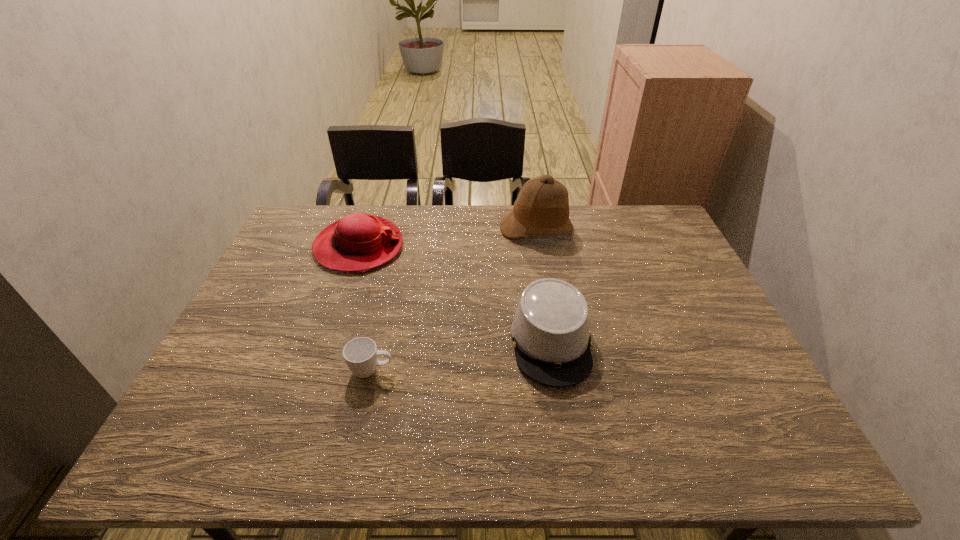
Locate an element on the screen. unoccupied position between the shortest object and the nearest hat is located at coordinates (462, 356).

Find the location of `vacant space that is in between the tallest object and the leftmost hat`. vacant space that is in between the tallest object and the leftmost hat is located at coordinates (447, 238).

This screenshot has height=540, width=960. In order to click on free space that is in between the shortest object and the tallest hat in this screenshot , I will do `click(454, 300)`.

You are a GUI agent. You are given a task and a screenshot of the screen. Output one action in this format:
    pyautogui.click(x=<x>, y=<y>)
    Task: Click on the free space that is in between the cup and the tallest hat
    
    Given the screenshot: What is the action you would take?
    pyautogui.click(x=454, y=300)

Locate which object is the closest to the tallest object. Please provide its 2D coordinates. Your answer should be formatted as a tuple, i.e. [(x, y)], where the tuple contains the x and y coordinates of a point satisfying the conditions above.

[(550, 331)]

Select which object is the closest to the tallest hat. Please provide its 2D coordinates. Your answer should be formatted as a tuple, i.e. [(x, y)], where the tuple contains the x and y coordinates of a point satisfying the conditions above.

[(550, 331)]

The image size is (960, 540). I want to click on hat that is the nearest to the leftmost hat, so click(542, 206).

This screenshot has height=540, width=960. In order to click on hat that is the third closest to the cup in this screenshot , I will do `click(542, 206)`.

The width and height of the screenshot is (960, 540). I want to click on vacant area in the image that satisfies the following two spatial constraints: 1. on the front-facing side of the tallest hat; 2. at the front of the leftmost hat with a bow, so click(x=540, y=247).

Find the location of a particular element. This screenshot has width=960, height=540. free space in the image that satisfies the following two spatial constraints: 1. on the front-facing side of the tallest object; 2. at the front of the leftmost hat with a bow is located at coordinates (540, 247).